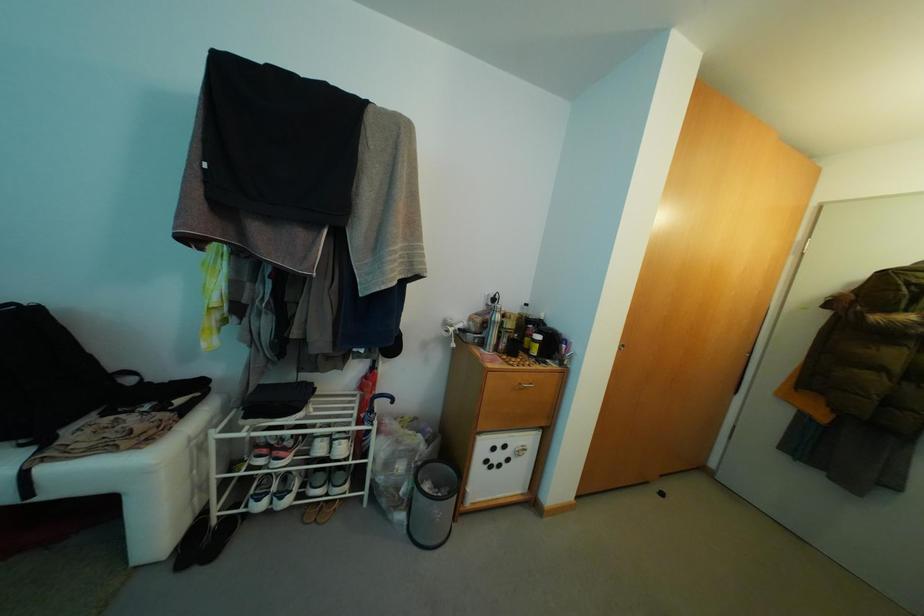
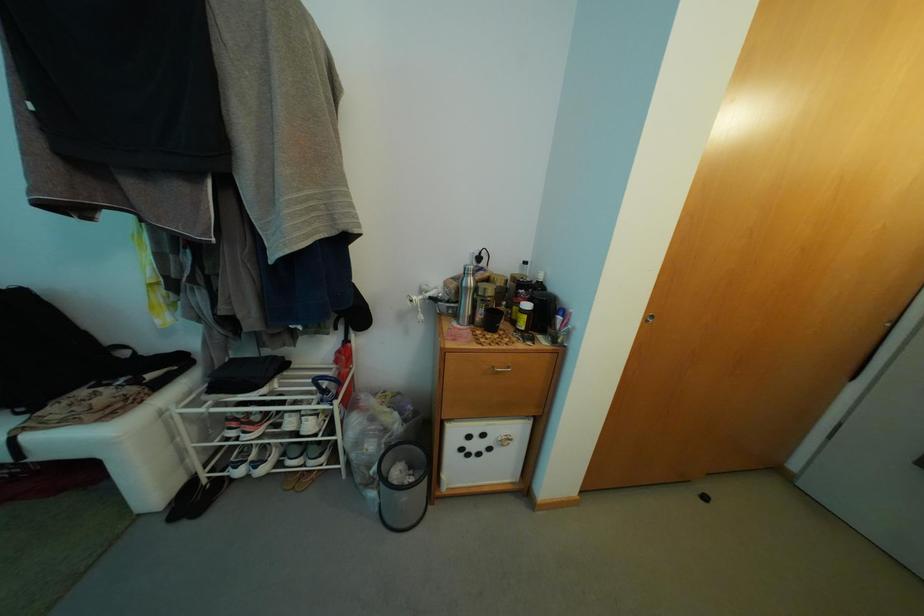
Question: How did the camera likely rotate?

Choices:
 (A) Left
 (B) Right
 (C) Up
 (D) Down

Answer: (A)